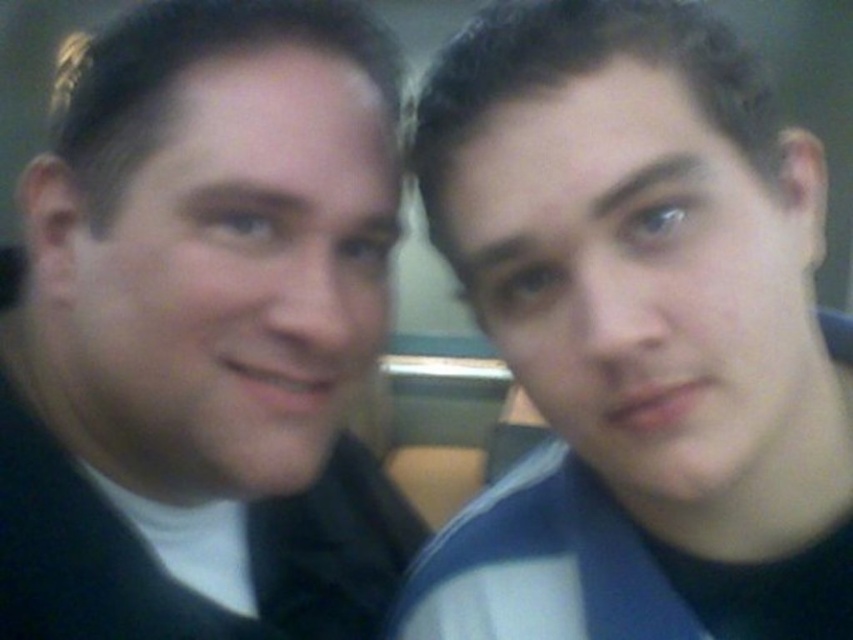
Question: Does black matte suit at left appear on the right side of blue striped shirt at right?

Choices:
 (A) yes
 (B) no

Answer: (B)

Question: Does black matte suit at left appear over blue striped shirt at right?

Choices:
 (A) yes
 (B) no

Answer: (A)

Question: Which point is farther to the camera?

Choices:
 (A) black matte suit at left
 (B) blue striped shirt at right

Answer: (A)

Question: Which of the following is the closest to the observer?

Choices:
 (A) (517, 481)
 (B) (189, 384)

Answer: (B)

Question: Is black matte suit at left bigger than blue striped shirt at right?

Choices:
 (A) yes
 (B) no

Answer: (A)